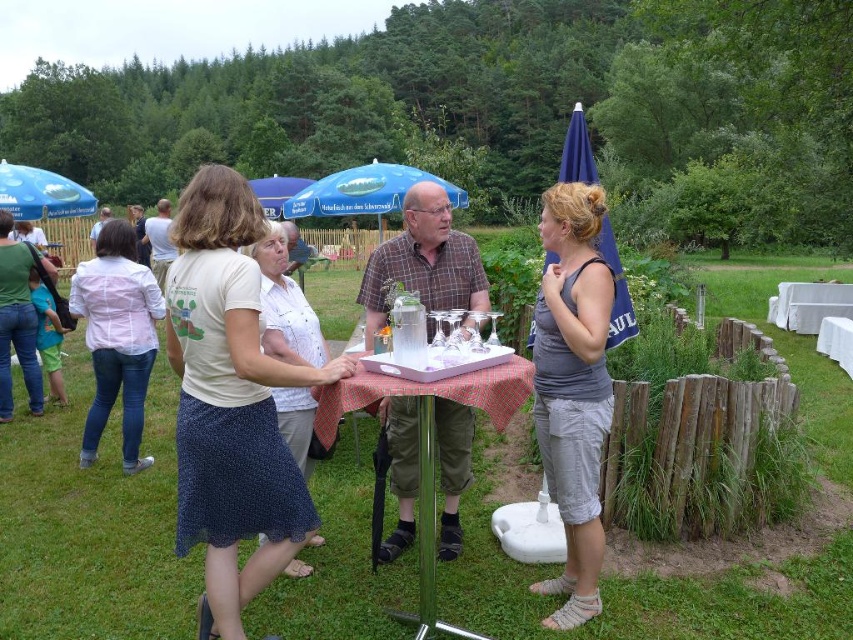
You are standing at the point marked as point (216,328) in the image. You want to walk to the nearest tree located 10 meters away from your current position. How far will you have to walk in total?

You will have to walk 10 meters to reach the nearest tree from your current position at point (216,328).